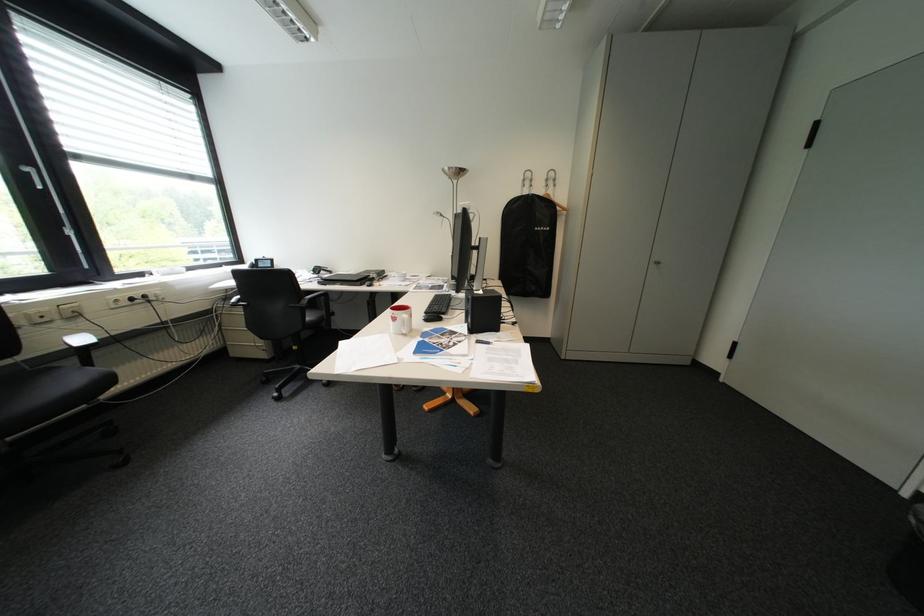
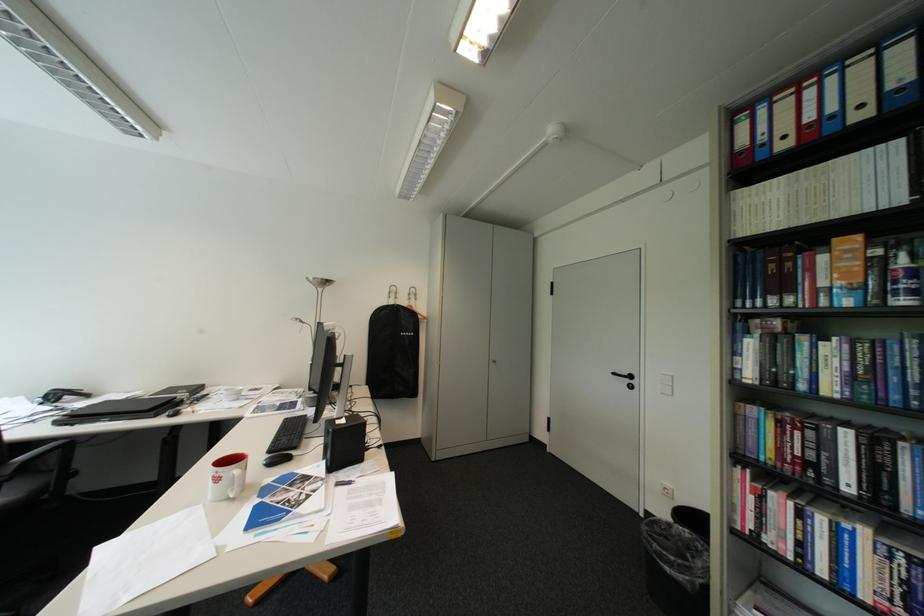
Locate, in the second image, the point that corresponds to the point at 664,265 in the first image.

(504, 363)